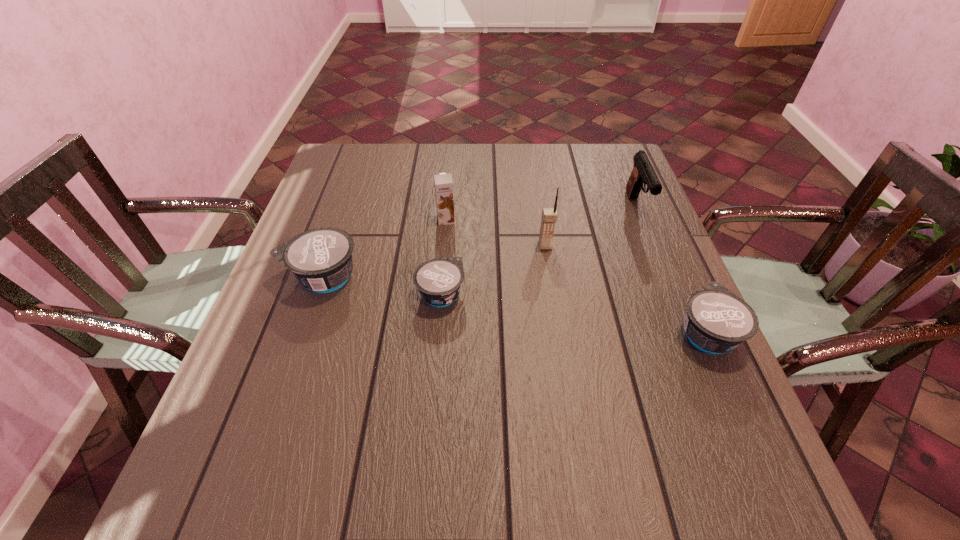
Find the location of a particular element. This screenshot has width=960, height=540. vacant region between the chocolate milk and the fourth nearest object is located at coordinates coord(495,233).

The image size is (960, 540). What are the coordinates of `vacant area that lies between the shortest yogurt and the second shortest yogurt` in the screenshot? It's located at (573, 314).

At what (x,y) coordinates should I click in order to perform the action: click on object that stands as the fifth closest to the pistol. Please return your answer as a coordinate pair (x, y). The height and width of the screenshot is (540, 960). Looking at the image, I should click on (321, 258).

Identify which object is located as the third nearest to the leftmost yogurt. Please provide its 2D coordinates. Your answer should be formatted as a tuple, i.e. [(x, y)], where the tuple contains the x and y coordinates of a point satisfying the conditions above.

[(549, 215)]

Identify which yogurt is located as the nearest to the chocolate milk. Please provide its 2D coordinates. Your answer should be formatted as a tuple, i.e. [(x, y)], where the tuple contains the x and y coordinates of a point satisfying the conditions above.

[(439, 280)]

Identify the location of the second closest yogurt to the fifth tallest object. This screenshot has height=540, width=960. (321, 258).

Where is `free space that satisfies the following two spatial constraints: 1. on the back side of the chocolate milk; 2. on the left side of the leftmost yogurt`? free space that satisfies the following two spatial constraints: 1. on the back side of the chocolate milk; 2. on the left side of the leftmost yogurt is located at coordinates (342, 220).

Find the location of a particular element. The height and width of the screenshot is (540, 960). blank area in the image that satisfies the following two spatial constraints: 1. at the barrel of the pistol; 2. on the left side of the rightmost yogurt is located at coordinates (687, 333).

The width and height of the screenshot is (960, 540). I want to click on vacant space that satisfies the following two spatial constraints: 1. at the barrel of the pistol; 2. on the left side of the fifth tallest object, so click(x=687, y=333).

Where is `free spot that satisfies the following two spatial constraints: 1. on the front of the rightmost yogurt, where the keypad is located; 2. on the left side of the tallest object`? The image size is (960, 540). free spot that satisfies the following two spatial constraints: 1. on the front of the rightmost yogurt, where the keypad is located; 2. on the left side of the tallest object is located at coordinates click(x=559, y=333).